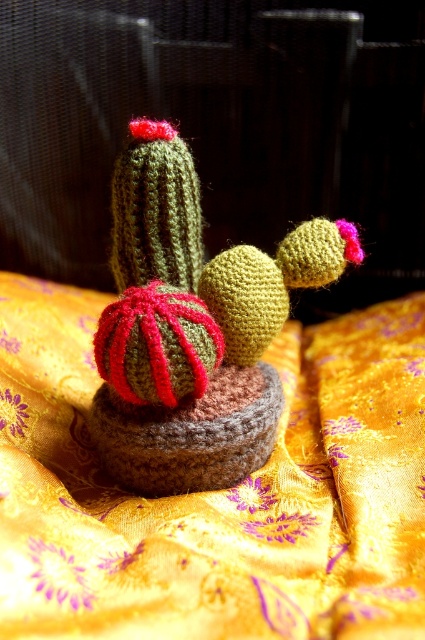
You are holding a 30 cm wide crochet cactus that you want to place on the yellow satin blanket at center. Can you fit it without overlapping the edges?

The yellow satin blanket at center is 55.13 centimeters away from you, but this distance does not indicate its size. Without knowing the blanket size, it is impossible to determine if the 30 cm wide cactus will fit without overlapping the edges.

You are looking at the crocheted cacti on the yellow fabric. There are two points marked in the image. One is at coordinate point (19, 596) and the other is at point (161, 202). Which point is closer to you?

Point (19, 596) is closer to you because it is in front of point (161, 202).

You are organizing a craft fair booth and need to arrange the yellow satin blanket at center and the knitted green cactus at center. According to the image, which item is positioned lower?

The yellow satin blanket at center is located below the knitted green cactus at center, so it is positioned lower.